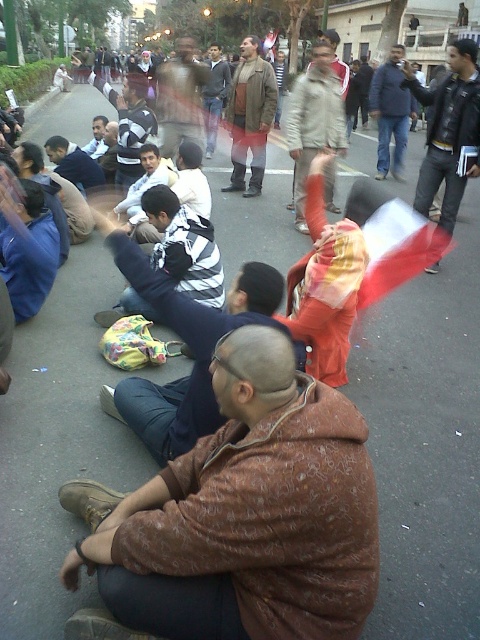
Question: From the image, what is the correct spatial relationship of matte brown jacket at center in relation to striped shirt at center?

Choices:
 (A) below
 (B) above

Answer: (B)

Question: Which point is farther from the camera taking this photo?

Choices:
 (A) (444, 204)
 (B) (303, 74)
 (C) (212, 97)
 (D) (131, 212)

Answer: (B)

Question: Which point appears farthest from the camera in this image?

Choices:
 (A) (208, 93)
 (B) (455, 163)
 (C) (132, 188)
 (D) (339, 88)

Answer: (A)

Question: From the image, what is the correct spatial relationship of striped fabric shirt at center in relation to blue jeans at center?

Choices:
 (A) right
 (B) left

Answer: (B)

Question: Estimate the real-world distances between objects in this image. Which object is closer to the brown textured jacket at lower center?

Choices:
 (A) striped shirt at center
 (B) brown textured jacket at center

Answer: (A)

Question: From the image, what is the correct spatial relationship of light beige jacket at center in relation to blue jeans at center?

Choices:
 (A) left
 (B) right

Answer: (A)